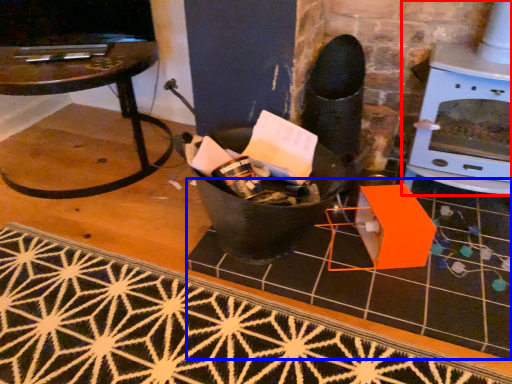
Question: Which object appears closest to the camera in this image, fireplace (highlighted by a red box) or tile (highlighted by a blue box)?

Choices:
 (A) fireplace
 (B) tile

Answer: (B)